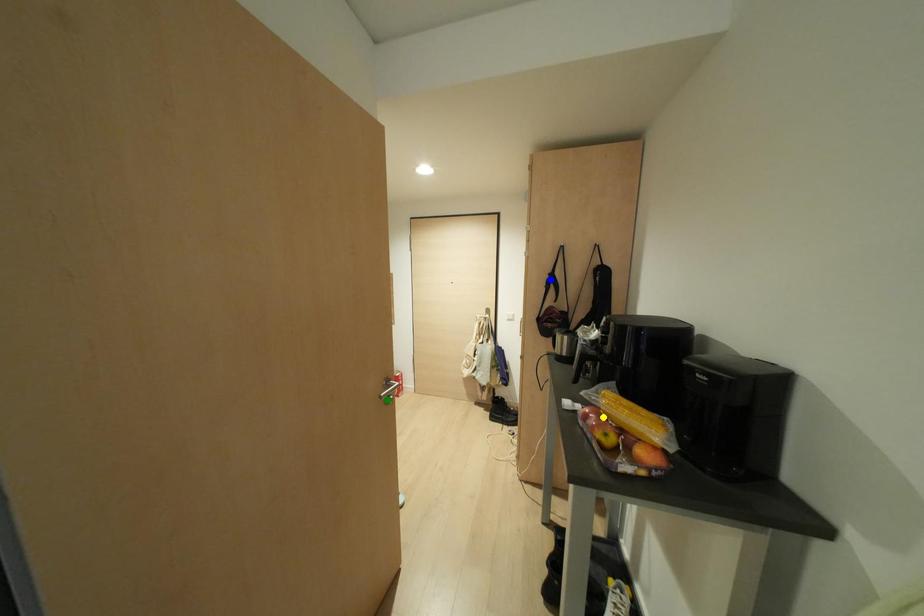
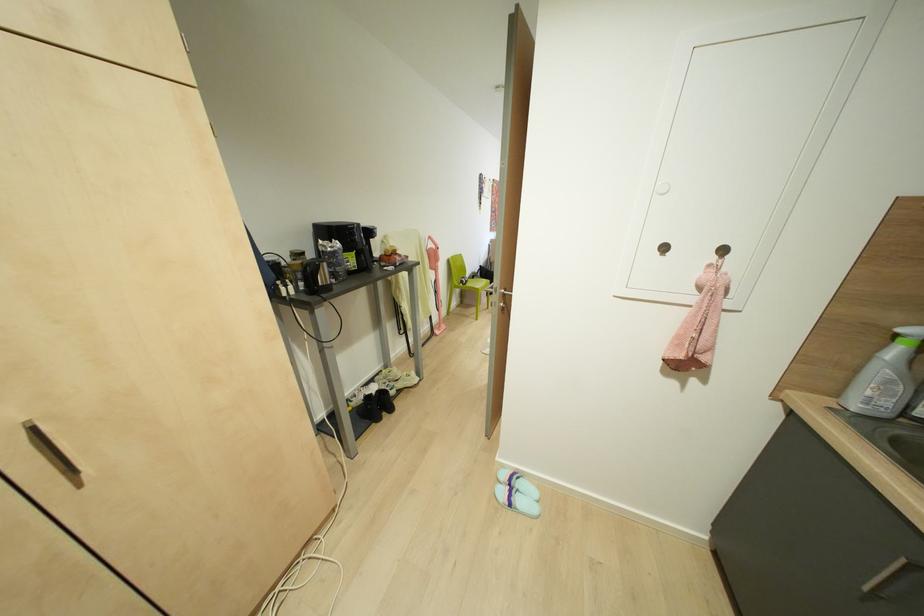
I am providing you with two images of the same scene from different viewpoints. Three points are marked in image1. Which point corresponds to a part or object that is occluded in image2?In image1, three points are marked. Which of them correspond to a part or object that is occluded in image2?Among the three points shown in image1, which one corresponds to a part or object that is no longer visible due to occlusion in image2?

blue point, yellow point, green point